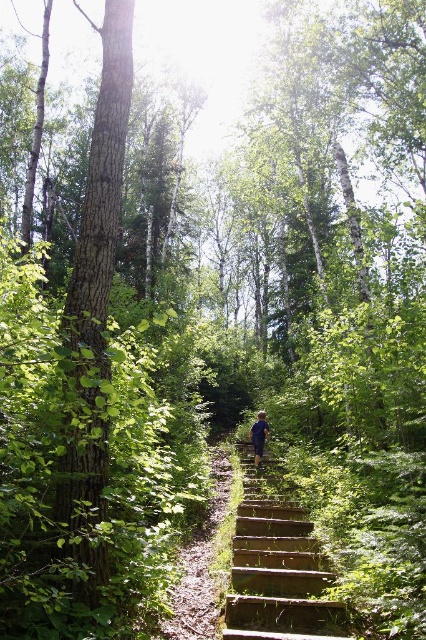
Is point (296, 513) more distant than point (264, 444)?

No, (296, 513) is closer to viewer.

Between point (236, 541) and point (253, 442), which one is positioned behind?

Point (253, 442)

The height and width of the screenshot is (640, 426). Identify the location of wooden stairs at center. point(276,570).

Find the location of a particular element. wooden stairs at center is located at coordinates (276, 570).

This screenshot has width=426, height=640. In order to click on green rough bark tree at left in this screenshot , I will do `click(94, 284)`.

Does green rough bark tree at left have a lesser width compared to blue fabric hiker at center?

Incorrect, green rough bark tree at left's width is not less than blue fabric hiker at center's.

Does point (83, 372) come closer to viewer compared to point (258, 419)?

That is True.

At what (x,y) coordinates should I click in order to perform the action: click on green rough bark tree at left. Please return your answer as a coordinate pair (x, y). Image resolution: width=426 pixels, height=640 pixels. Looking at the image, I should click on pos(94,284).

Can you confirm if green rough bark tree at left is shorter than wooden stairs at center?

In fact, green rough bark tree at left may be taller than wooden stairs at center.

Who is more forward, (97, 372) or (310, 604)?

Positioned in front is point (97, 372).

The image size is (426, 640). What are the coordinates of `green rough bark tree at left` in the screenshot? It's located at (94, 284).